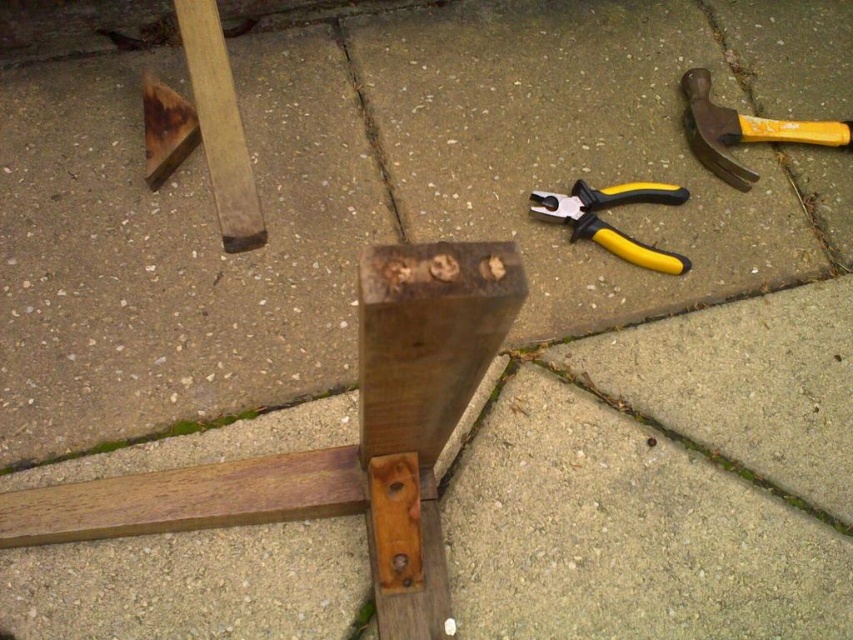
You are a carpenter working on the wooden post and need to reach both the brown wood plank at upper left and the yellow rubber hammer at upper right. Which tool is easier to grab without moving your current position?

The brown wood plank at upper left is closer to the viewer, so it is easier to grab without moving.

You are a carpenter working on this wooden structure. You need to reach both the natural wood post at center and the yellow rubber hammer at upper right. Which object is higher from the ground?

The yellow rubber hammer at upper right is higher from the ground than the natural wood post at center.